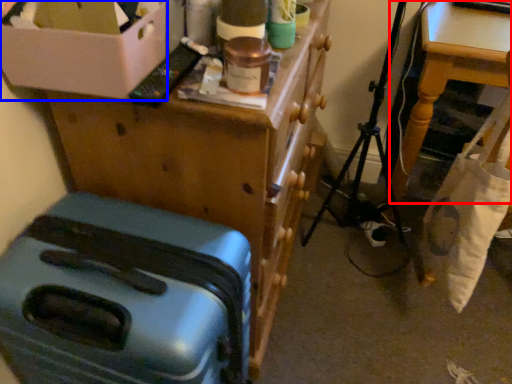
Question: Among these objects, which one is nearest to the camera, table (highlighted by a red box) or box (highlighted by a blue box)?

Choices:
 (A) table
 (B) box

Answer: (B)